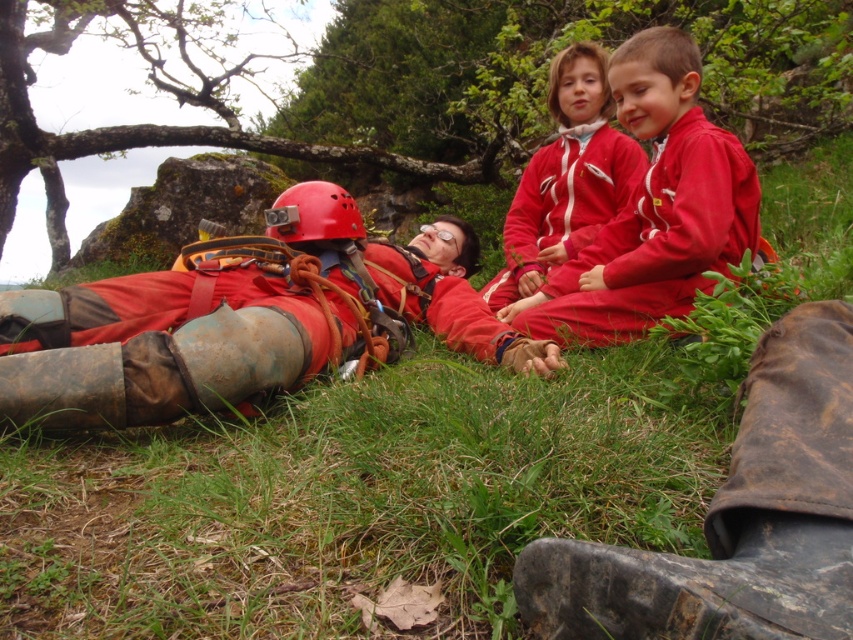
Does matte red tracksuit at center appear on the left side of red matte helmet at center?

No, matte red tracksuit at center is not to the left of red matte helmet at center.

Is matte red tracksuit at center shorter than red matte helmet at center?

Incorrect, matte red tracksuit at center's height does not fall short of red matte helmet at center's.

Is point (677, 144) in front of point (347, 202)?

That is True.

Find the location of a particular element. Image resolution: width=853 pixels, height=640 pixels. matte red tracksuit at center is located at coordinates (654, 208).

Is matte red tracksuit at center bigger than matte red jacket at upper right?

Yes.

Is matte red tracksuit at center to the right of matte red jacket at upper right from the viewer's perspective?

Indeed, matte red tracksuit at center is positioned on the right side of matte red jacket at upper right.

What do you see at coordinates (654, 208) in the screenshot?
I see `matte red tracksuit at center` at bounding box center [654, 208].

Where is `matte red tracksuit at center`? matte red tracksuit at center is located at coordinates (654, 208).

Does matte red jacket at upper right appear on the left side of red matte helmet at center?

Incorrect, matte red jacket at upper right is not on the left side of red matte helmet at center.

This screenshot has height=640, width=853. I want to click on matte red jacket at upper right, so click(x=566, y=177).

Find the location of a particular element. This screenshot has width=853, height=640. matte red jacket at upper right is located at coordinates (566, 177).